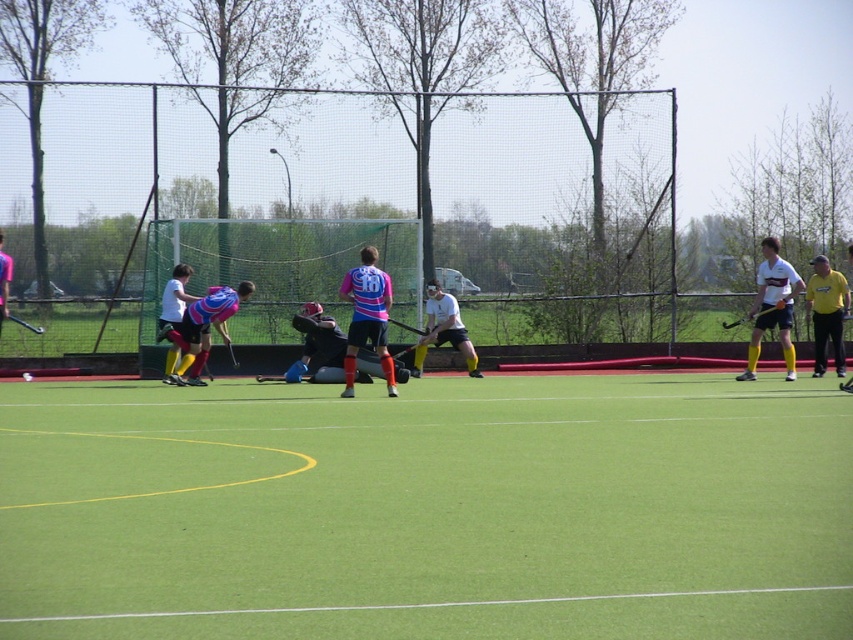
This screenshot has height=640, width=853. Describe the element at coordinates (772, 307) in the screenshot. I see `white matte hockey stick at right` at that location.

Which is above, white matte hockey stick at right or matte pink jersey at left?

white matte hockey stick at right is higher up.

Is point (778, 321) farther from camera compared to point (171, 323)?

No.

This screenshot has width=853, height=640. I want to click on white matte hockey stick at right, so click(772, 307).

Which is above, matte black helmet at center or yellow matte shirt at right?

yellow matte shirt at right is higher up.

Is point (329, 324) closer to camera compared to point (825, 353)?

No, it is not.

This screenshot has width=853, height=640. In order to click on matte black helmet at center in this screenshot , I will do `click(317, 346)`.

Does yellow matte shirt at right appear under matte pink jersey at left?

Actually, yellow matte shirt at right is above matte pink jersey at left.

Can you confirm if yellow matte shirt at right is positioned above matte pink jersey at left?

Yes.

Does point (813, 312) lie in front of point (161, 296)?

Yes, it is in front of point (161, 296).

Locate an element on the screen. The height and width of the screenshot is (640, 853). yellow matte shirt at right is located at coordinates (827, 314).